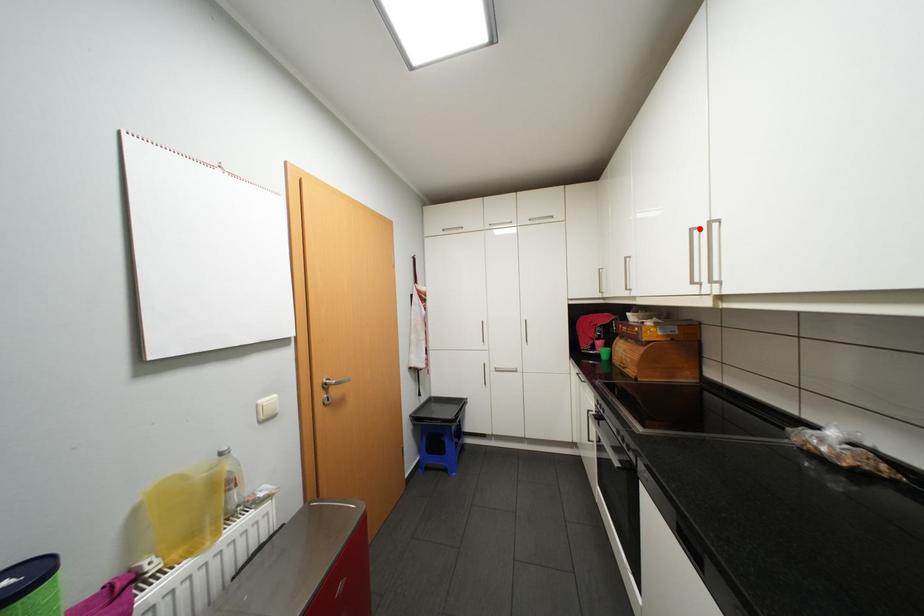
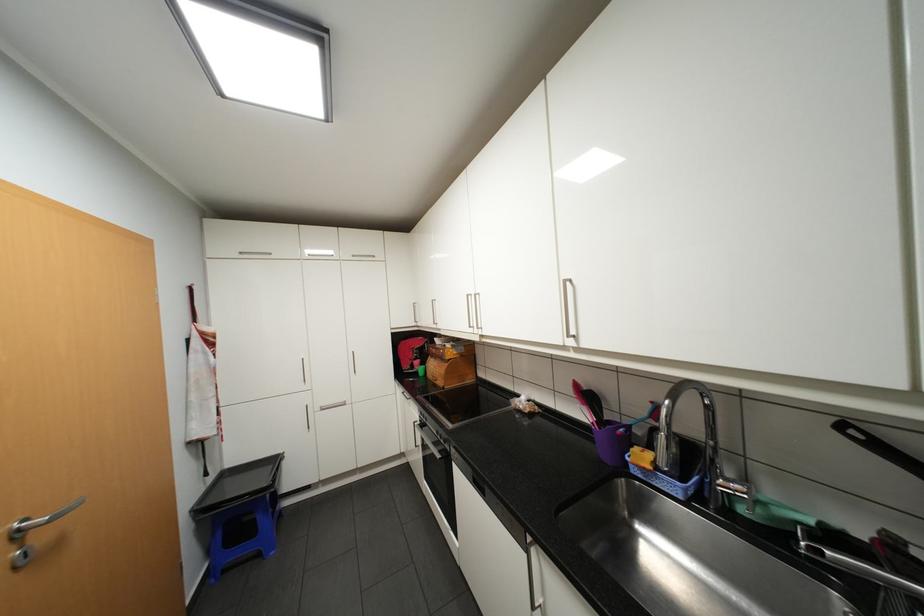
In the second image, find the point that corresponds to the highlighted location in the first image.

(476, 294)